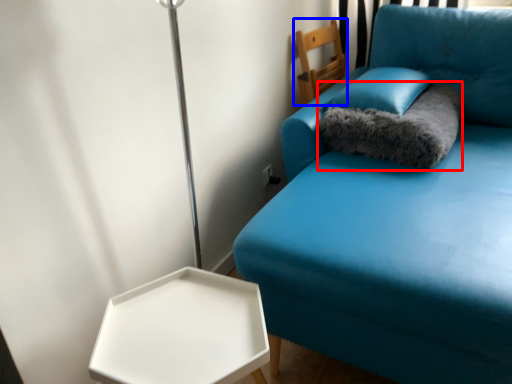
Question: Which of the following is the closest to the observer, cat bed (highlighted by a red box) or furniture (highlighted by a blue box)?

Choices:
 (A) cat bed
 (B) furniture

Answer: (A)